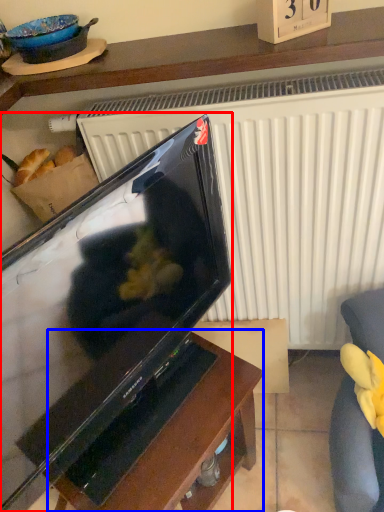
Question: Which object is closer to the camera taking this photo, television (highlighted by a red box) or table (highlighted by a blue box)?

Choices:
 (A) television
 (B) table

Answer: (A)